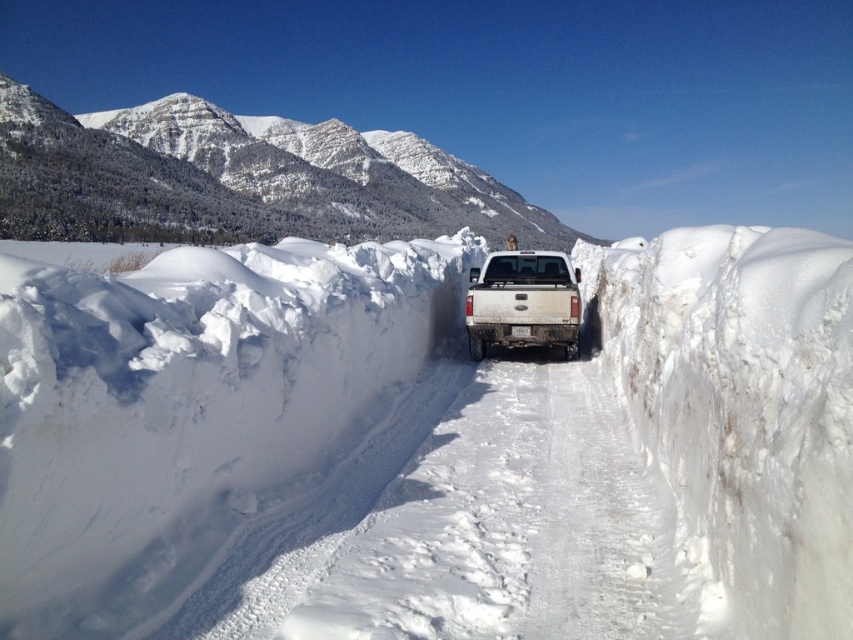
Between white fluffy snow at center and snowy granite mountain at upper center, which one has less height?

With less height is white fluffy snow at center.

Between point (793, 288) and point (224, 115), which one is positioned behind?

Point (224, 115)

At what (x,y) coordinates should I click in order to perform the action: click on white fluffy snow at center. Please return your answer as a coordinate pair (x, y). Image resolution: width=853 pixels, height=640 pixels. Looking at the image, I should click on (426, 445).

Is white fluffy snow at center to the left of white matte truck at center from the viewer's perspective?

Correct, you'll find white fluffy snow at center to the left of white matte truck at center.

Which is behind, point (222, 307) or point (527, 272)?

Positioned behind is point (527, 272).

Does point (750, 433) come farther from viewer compared to point (556, 292)?

No.

Where is `white fluffy snow at center`? white fluffy snow at center is located at coordinates (426, 445).

Does point (320, 188) come in front of point (469, 337)?

No, (320, 188) is behind (469, 337).

Can you confirm if snowy granite mountain at upper center is bigger than white matte truck at center?

Indeed, snowy granite mountain at upper center has a larger size compared to white matte truck at center.

This screenshot has width=853, height=640. What do you see at coordinates (239, 179) in the screenshot? I see `snowy granite mountain at upper center` at bounding box center [239, 179].

You are a GUI agent. You are given a task and a screenshot of the screen. Output one action in this format:
    pyautogui.click(x=<x>, y=<y>)
    Task: Click on the snowy granite mountain at upper center
    
    Given the screenshot: What is the action you would take?
    pyautogui.click(x=239, y=179)